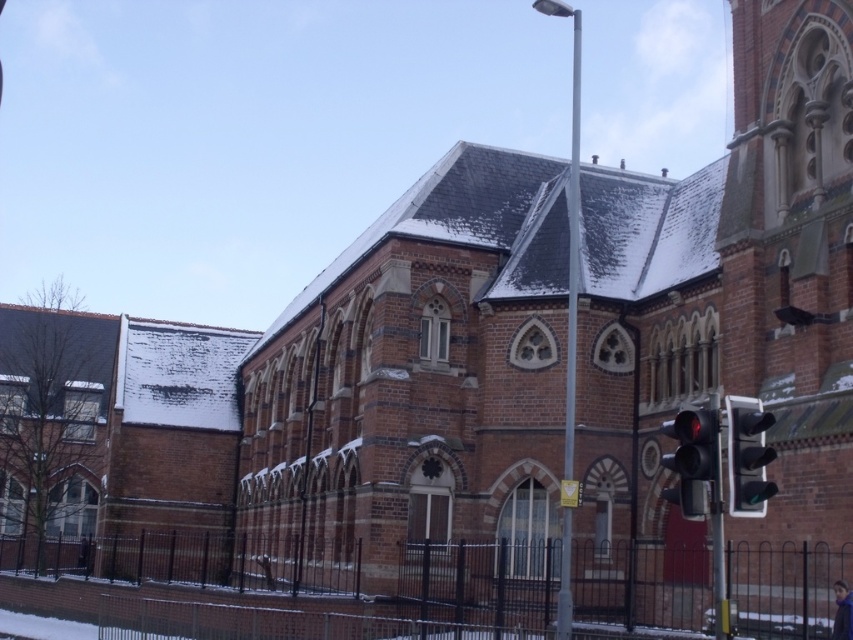
Question: Can you confirm if red glass traffic light at lower right is positioned below metallic traffic light at right?

Choices:
 (A) no
 (B) yes

Answer: (B)

Question: Does red glass traffic light at lower right appear over metallic traffic light at right?

Choices:
 (A) yes
 (B) no

Answer: (B)

Question: Which object appears farthest from the camera in this image?

Choices:
 (A) red glass traffic light at lower right
 (B) metallic traffic light at right

Answer: (A)

Question: Among these points, which one is farthest from the camera?

Choices:
 (A) (682, 416)
 (B) (747, 516)

Answer: (A)

Question: Is red glass traffic light at lower right further to the viewer compared to metallic traffic light at right?

Choices:
 (A) no
 (B) yes

Answer: (B)